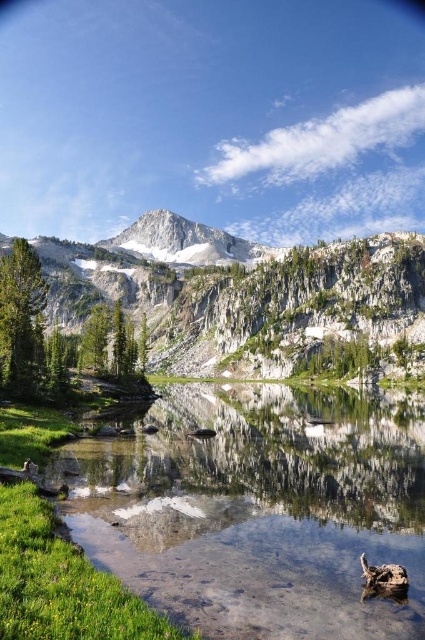
You are standing at the edge of the clear glass pond at center and want to reach the white rocky mountain at center. Which direction should you move to get closer to the mountain?

Since the clear glass pond at center is closer to the viewer than the white rocky mountain at center, you should move forward away from the pond towards the mountain to get closer to it.

You are standing at the edge of the lake and looking out. Which of the two points, point (399, 275) or point (147, 230), is closer to you?

Point (399, 275) is closer to the viewer than point (147, 230).